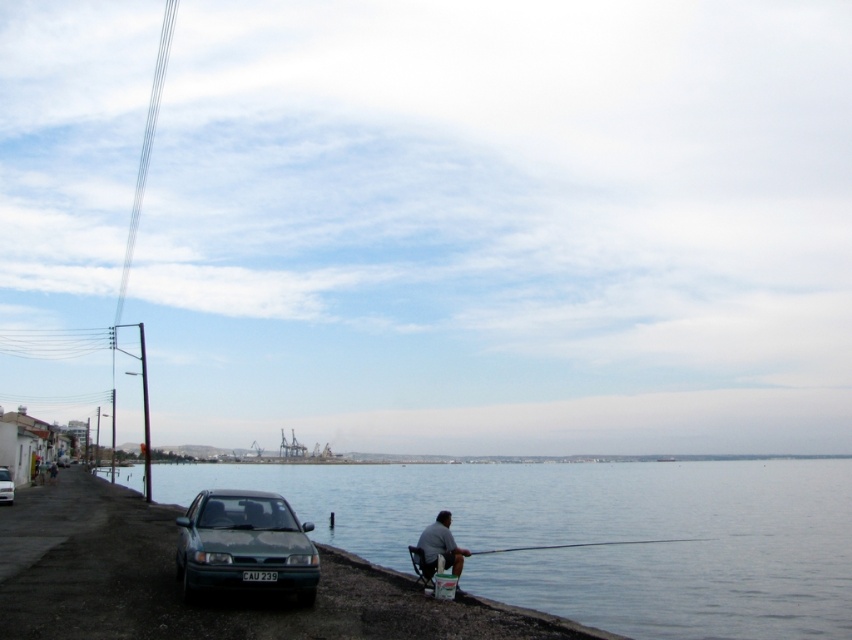
You are standing on the paved area and want to place a small red cooler between the clear water at lower left and the green matte car at lower left. Is there enough space between them to fit the cooler?

The clear water at lower left is located below the green matte car at lower left, so there is space between them to place the cooler.

You are a photographer wanting to capture both the smooth wooden rod at lower center and the green matte car at lower left in a single frame. Given their sizes, which object should you focus on to ensure both are clearly visible in the photo?

The smooth wooden rod at lower center is smaller than the green matte car at lower left. To ensure both are clearly visible, focus on the green matte car at lower left since it is larger and will remain in focus while the smaller rod can be captured in the same frame without blurring.

You are a photographer standing at the edge of the pavement. You want to take a picture of the clear water at lower left and the gray fabric chair at lower center. Which object is closer to the left side of your camera frame?

The gray fabric chair at lower center is closer to the left side of the camera frame because the clear water at lower left is positioned to its right side.